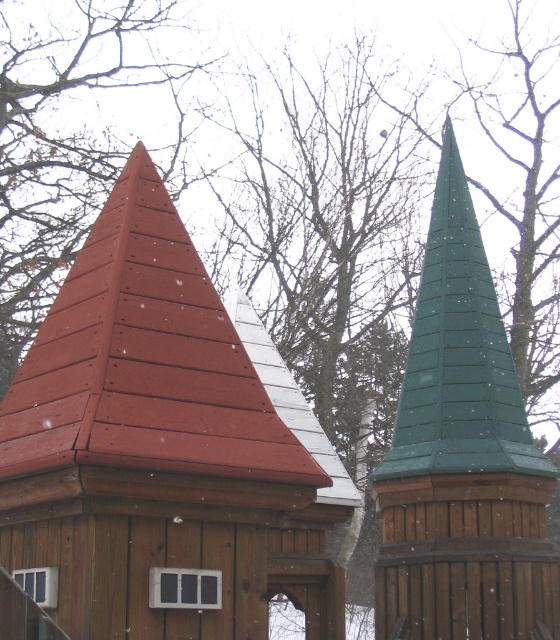
You are standing in a winter landscape with two structures. You see the matte red shingles at upper left and the green wooden spire at right. Which structure is closer to you?

The matte red shingles at upper left is in front of the green wooden spire at right, so the structure with the matte red shingles at upper left is closer to you.

You are an architect designing a winter landscape scene. You need to place a decorative element between the matte red shingles at upper left and the green wooden spire at right. Which structure should the element be closer to, based on their widths?

The matte red shingles at upper left has a smaller width compared to the green wooden spire at right. Therefore, the decorative element should be placed closer to the matte red shingles at upper left to maintain visual balance.